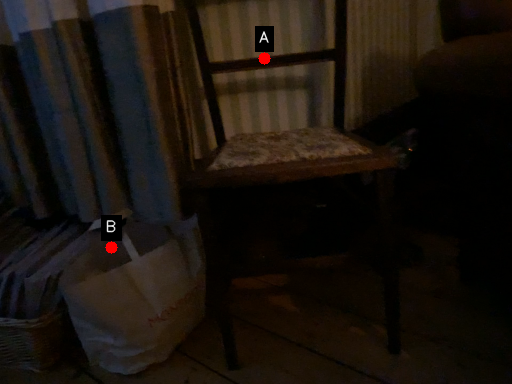
Question: Two points are circled on the image, labeled by A and B beside each circle. Which point is farther to the camera?

Choices:
 (A) A is further
 (B) B is further

Answer: (A)